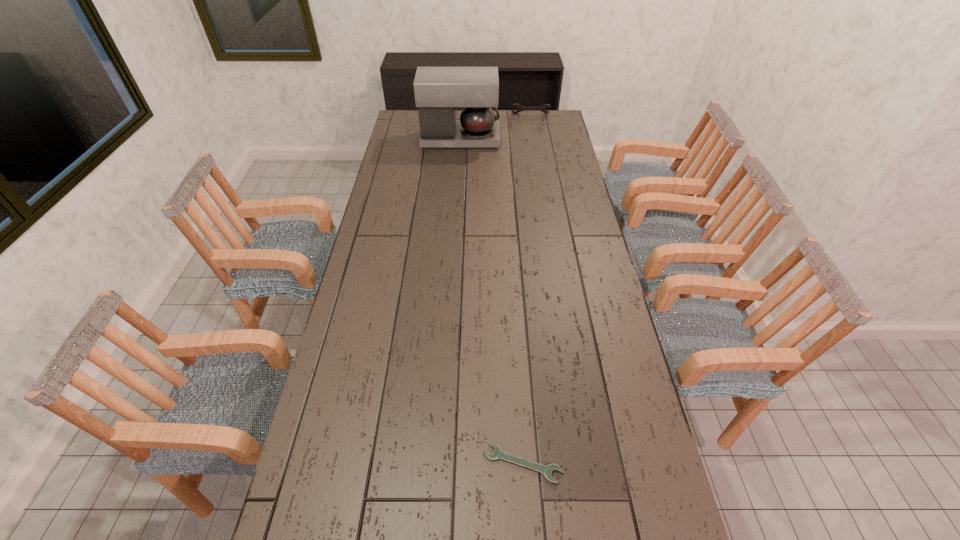
Find the location of a particular element. The height and width of the screenshot is (540, 960). coffee maker is located at coordinates (438, 91).

What are the coordinates of `the second farthest object` in the screenshot? It's located at (438, 91).

Where is `the farthest object`? The height and width of the screenshot is (540, 960). the farthest object is located at coordinates (520, 108).

Locate an element on the screen. The height and width of the screenshot is (540, 960). the farther wrench is located at coordinates (520, 108).

I want to click on the shortest object, so click(546, 470).

The height and width of the screenshot is (540, 960). I want to click on the nearer wrench, so click(546, 470).

You are a GUI agent. You are given a task and a screenshot of the screen. Output one action in this format:
    pyautogui.click(x=<x>, y=<y>)
    Task: Click on the free location located 0.300m on the carafe side of the tallest object
    
    Given the screenshot: What is the action you would take?
    pyautogui.click(x=559, y=139)

In order to click on vacant space situated on the open ends of the taller wrench in this screenshot , I will do `click(536, 143)`.

Find the location of a particular element. vacant space located 0.150m on the left of the shortest object is located at coordinates (423, 464).

At what (x,y) coordinates should I click in order to perform the action: click on coffee maker at the far edge. Please return your answer as a coordinate pair (x, y). The width and height of the screenshot is (960, 540). Looking at the image, I should click on (438, 91).